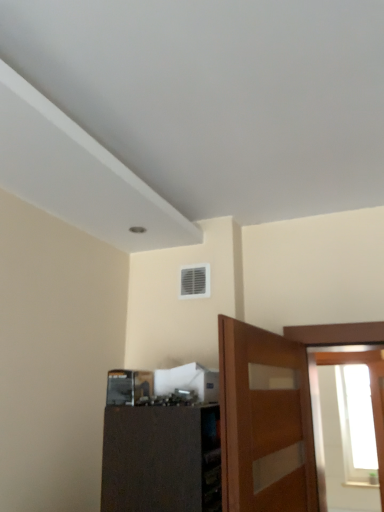
What is the approximate width of transparent glass window at right?

4.89 inches.

Measure the distance between transparent glass window at right and camera.

The depth of transparent glass window at right is 9.23 feet.

What do you see at coordinates (370, 381) in the screenshot? This screenshot has height=512, width=384. I see `transparent glass window at right` at bounding box center [370, 381].

This screenshot has width=384, height=512. Find the location of `transparent glass window at right`. transparent glass window at right is located at coordinates (370, 381).

Where is `transparent glass window at right`? transparent glass window at right is located at coordinates (370, 381).